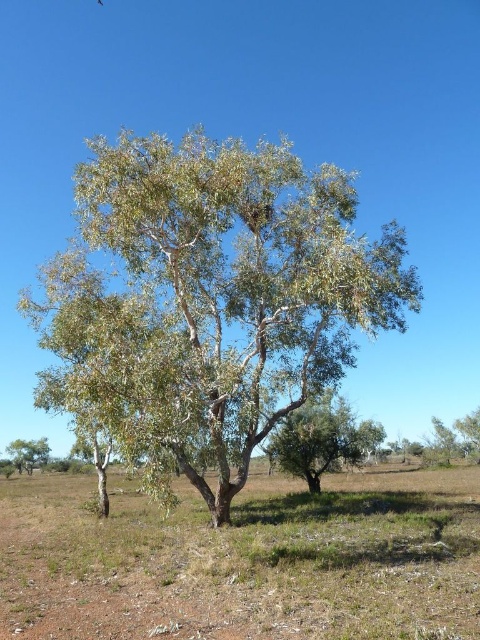
Question: Where is white papery bark tree at center located in relation to green leafy tree at center in the image?

Choices:
 (A) right
 (B) left

Answer: (B)

Question: Which object is the closest to the white papery bark tree at center?

Choices:
 (A) brown soil at center
 (B) green leafy tree at lower left

Answer: (A)

Question: Considering the real-world distances, which object is farthest from the brown soil at center?

Choices:
 (A) green leafy tree at center
 (B) white papery bark tree at center
 (C) green leafy tree at lower left

Answer: (C)

Question: Can you confirm if green leafy tree at center is bigger than green leafy tree at lower left?

Choices:
 (A) no
 (B) yes

Answer: (B)

Question: Is white papery bark tree at center thinner than green leafy tree at center?

Choices:
 (A) no
 (B) yes

Answer: (A)

Question: Which of the following is the farthest from the observer?

Choices:
 (A) brown soil at center
 (B) white papery bark tree at center
 (C) green leafy tree at lower left
 (D) green leafy tree at center

Answer: (C)